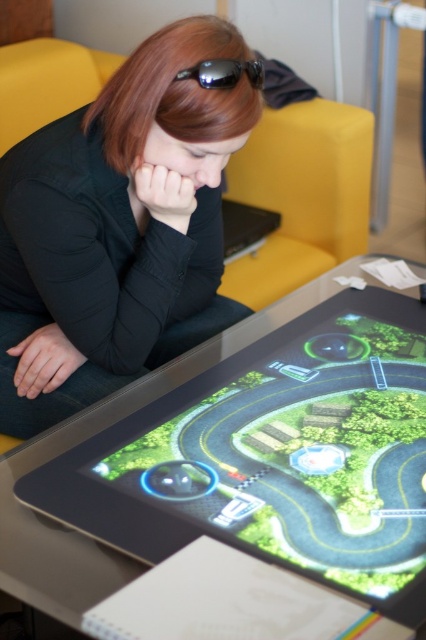
Question: Which of these objects is positioned farthest from the black reflective goggles at upper center?

Choices:
 (A) black matte shirt at center
 (B) green glossy tablet at center

Answer: (B)

Question: Is black matte shirt at center thinner than black reflective goggles at upper center?

Choices:
 (A) no
 (B) yes

Answer: (A)

Question: Estimate the real-world distances between objects in this image. Which object is farther from the green glossy tablet at center?

Choices:
 (A) black reflective goggles at upper center
 (B) black matte shirt at center

Answer: (A)

Question: Is black matte shirt at center below black reflective goggles at upper center?

Choices:
 (A) yes
 (B) no

Answer: (A)

Question: Which is nearer to the green glossy tablet at center?

Choices:
 (A) black matte shirt at center
 (B) black reflective goggles at upper center

Answer: (A)

Question: Does green glossy tablet at center appear under black reflective goggles at upper center?

Choices:
 (A) no
 (B) yes

Answer: (B)